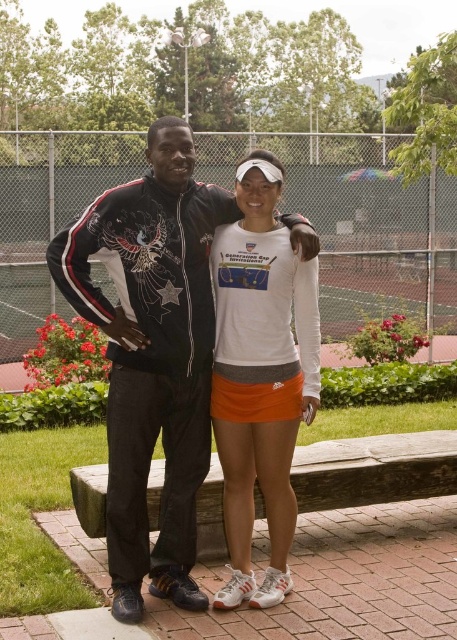
You are a photographer setting up for a tennis event. You need to position two props, the matte black jacket at center and the white matte tennis skirt at center, exactly 12 inches apart for a promotional photo. Based on the current arrangement shown in the image, will you need to move the props closer together or farther apart to meet the requirement?

The matte black jacket at center is currently 13.27 inches from the white matte tennis skirt at center. To achieve the required 12 inches, you need to move the props closer together by approximately 1.27 inches.

You are standing in front of the tennis court scene. There are two points marked in the image. The first point is at coordinate point (152, 250) and the second is at point (259, 376). Which point is closer to you?

Point (152, 250) is closer to the viewer than point (259, 376).